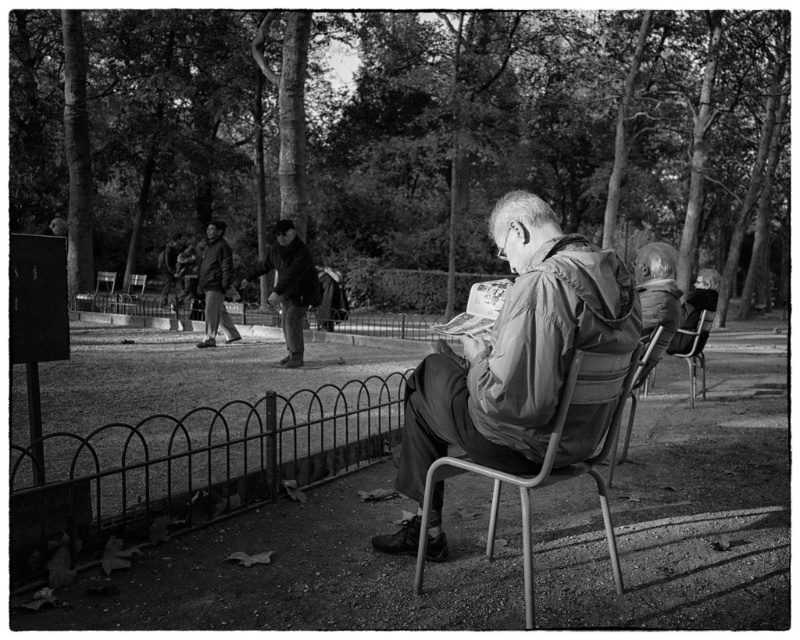
You are a park visitor who wants to sit down. You see a metallic gray folding chair at center and a metallic silver chair at lower left. Which chair has a smaller width?

The metallic gray folding chair at center has a smaller width than the metallic silver chair at lower left.